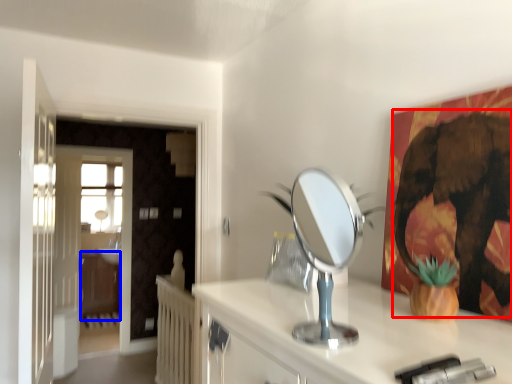
Question: Which object is further to the camera taking this photo, elephant (highlighted by a red box) or dresser (highlighted by a blue box)?

Choices:
 (A) elephant
 (B) dresser

Answer: (B)